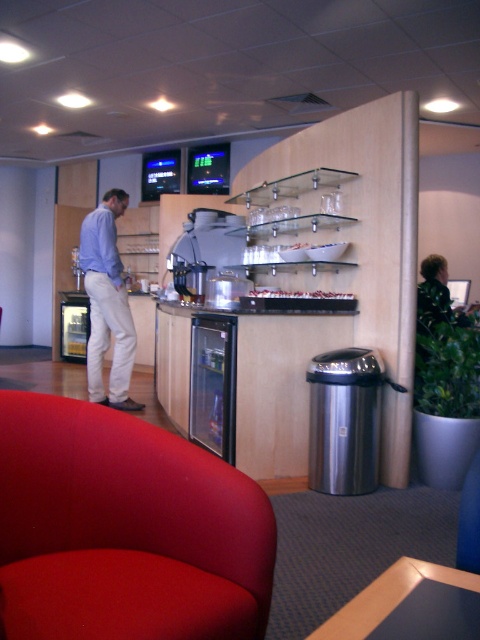
Question: Estimate the real-world distances between objects in this image. Which object is farther from the velvet red armchair at lower left?

Choices:
 (A) matte blue shirt at center
 (B) translucent glass cups at upper center

Answer: (A)

Question: Can you confirm if matte blue shirt at center is positioned below translucent glass cups at upper center?

Choices:
 (A) no
 (B) yes

Answer: (B)

Question: Does matte blue shirt at center appear on the right side of translucent glass cups at upper center?

Choices:
 (A) no
 (B) yes

Answer: (A)

Question: Estimate the real-world distances between objects in this image. Which object is closer to the translucent glass cups at upper center?

Choices:
 (A) matte blue shirt at center
 (B) velvet red armchair at lower left

Answer: (A)

Question: Is matte blue shirt at center behind translucent glass cups at upper center?

Choices:
 (A) no
 (B) yes

Answer: (B)

Question: Among these objects, which one is nearest to the camera?

Choices:
 (A) velvet red armchair at lower left
 (B) translucent glass cups at upper center
 (C) matte blue shirt at center

Answer: (A)